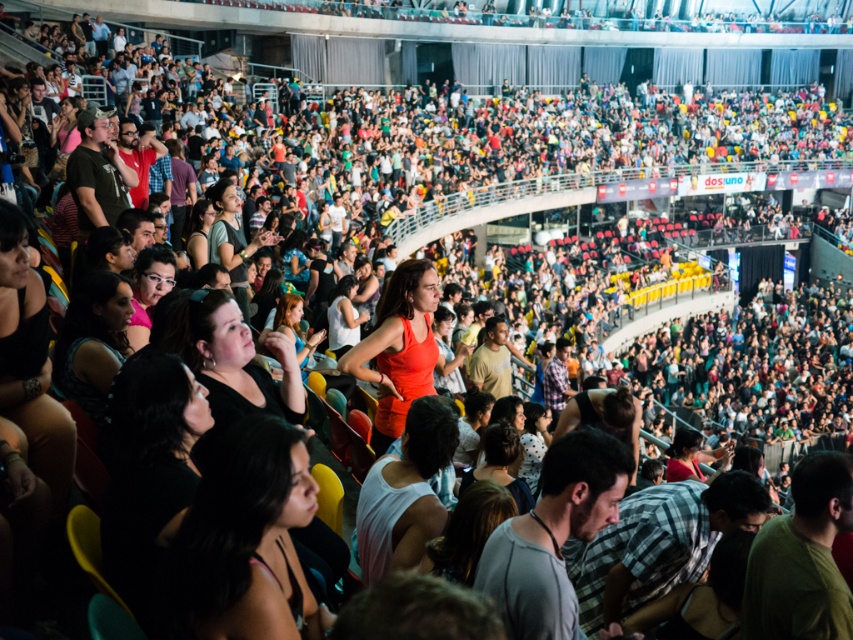
Is the position of dark hair at lower center more distant than that of dark green t-shirt at center?

No, dark hair at lower center is closer to the viewer.

Which is more to the left, dark hair at lower center or dark green t-shirt at center?

Positioned to the left is dark hair at lower center.

What are the coordinates of `dark hair at lower center` in the screenshot? It's located at (247, 538).

Can you confirm if dark green t-shirt at center is positioned to the right of matte orange dress at center?

Indeed, dark green t-shirt at center is positioned on the right side of matte orange dress at center.

Is dark green t-shirt at center positioned at the back of matte orange dress at center?

No, it is not.

Does point (788, 531) come closer to viewer compared to point (437, 289)?

Yes, it is.

What are the coordinates of `dark green t-shirt at center` in the screenshot? It's located at (802, 557).

Looking at this image, is dark hair at lower center thinner than matte orange dress at center?

Indeed, dark hair at lower center has a lesser width compared to matte orange dress at center.

Can you confirm if dark hair at lower center is positioned to the right of matte orange dress at center?

Incorrect, dark hair at lower center is not on the right side of matte orange dress at center.

This screenshot has width=853, height=640. What do you see at coordinates (247, 538) in the screenshot?
I see `dark hair at lower center` at bounding box center [247, 538].

I want to click on dark hair at lower center, so click(247, 538).